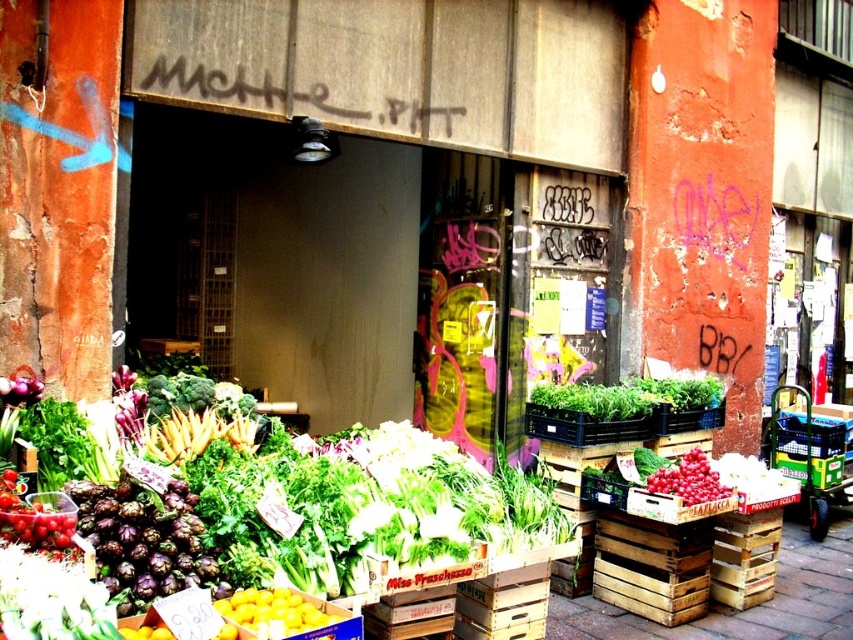
Does yellow matte lemons at center have a lesser height compared to red matte tomatoes at center?

Yes.

Who is higher up, yellow matte lemons at center or red matte tomatoes at center?

red matte tomatoes at center

Where is `yellow matte lemons at center`? This screenshot has height=640, width=853. yellow matte lemons at center is located at coordinates (274, 611).